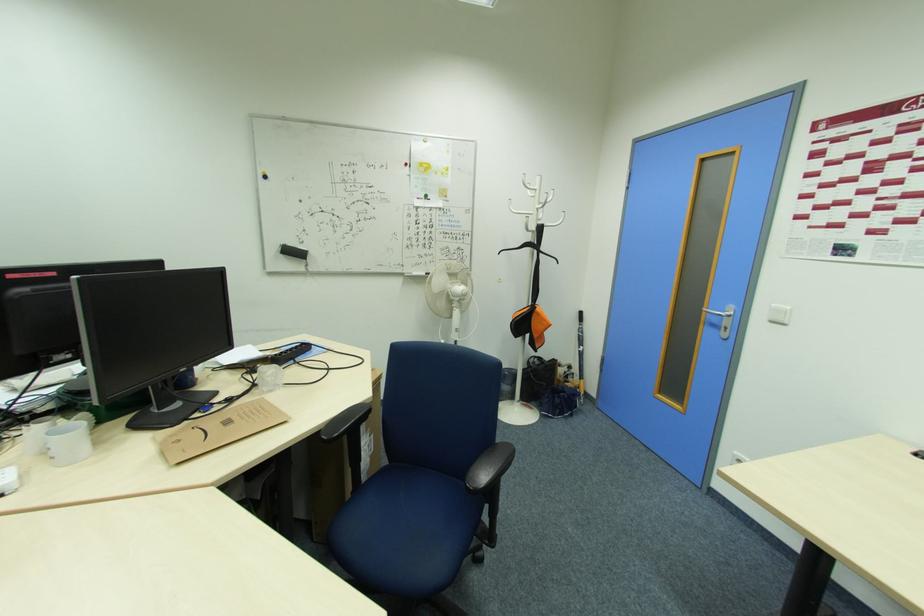
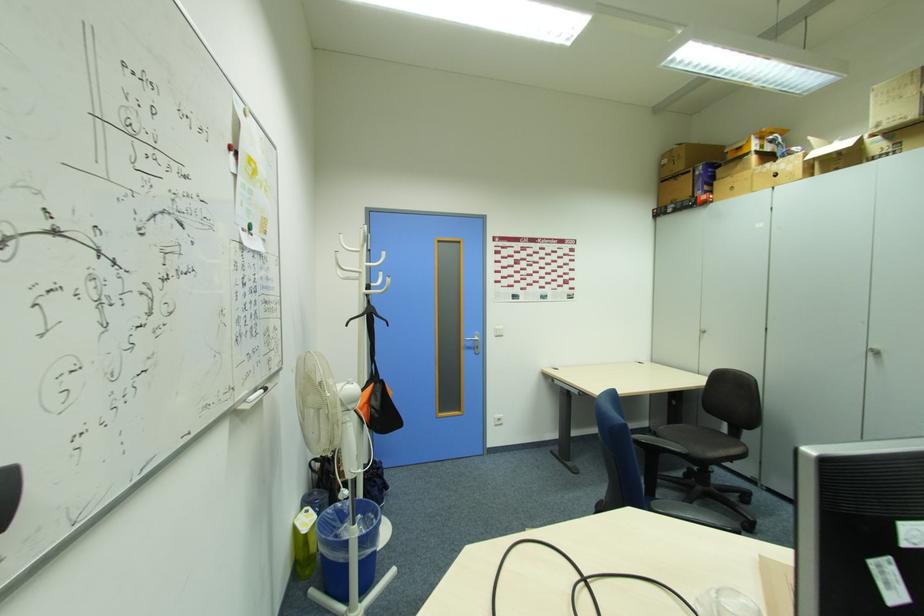
The point at [719,322] is marked in the first image. Where is the corresponding point in the second image?

(472, 346)